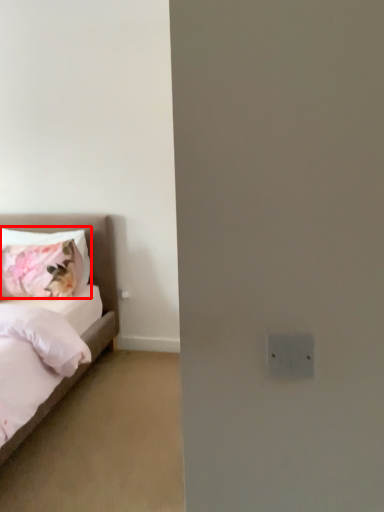
Question: From the image's perspective, where is pillow (annotated by the red box) located in relation to bed in the image?

Choices:
 (A) below
 (B) above

Answer: (B)